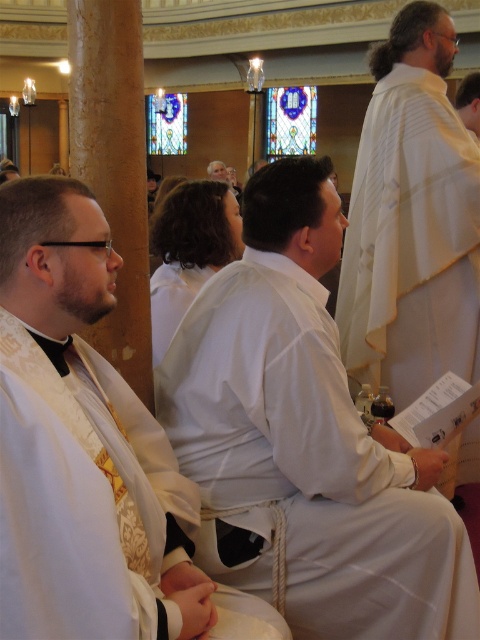
You are a photographer setting up a camera in the church. You need to capture both the white textured robe at center and the white matte robe at center in your shot. Which robe should you focus on first to ensure it fits entirely within the frame?

The white textured robe at center is larger in size than the white matte robe at center, so you should focus on capturing the white textured robe at center first to ensure it fits entirely within the frame.

You are standing at the entrance of the church and notice the white satin robe at center. Can you determine if the robe is closer to the front or the back of the church based on its position?

The white satin robe at center is located at point (82, 445), which places it closer to the front of the church since the coordinates suggest it is positioned near the entrance area.